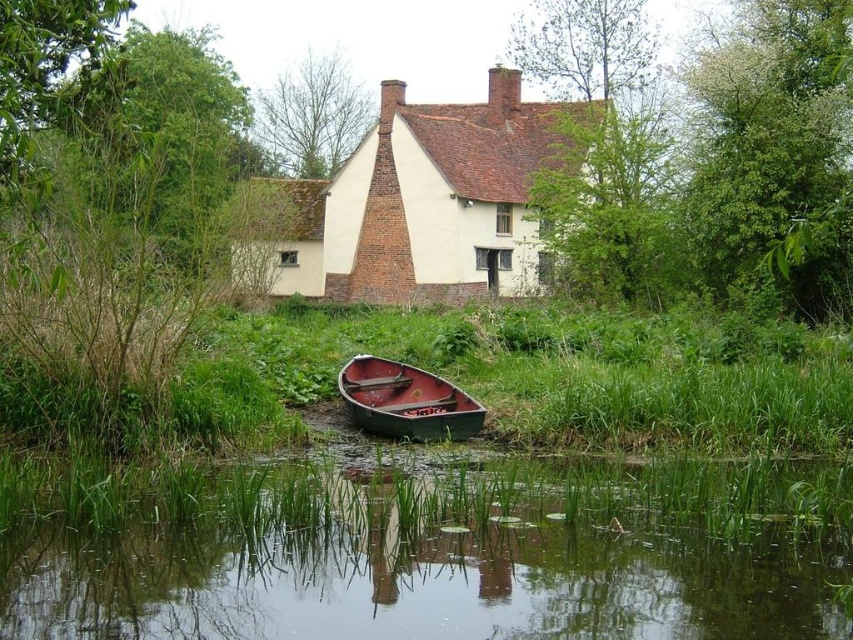
Question: Considering the relative positions of green grassy at lower center and white painted brick cottage at center in the image provided, where is green grassy at lower center located with respect to white painted brick cottage at center?

Choices:
 (A) right
 (B) left

Answer: (A)

Question: Which point appears closest to the camera in this image?

Choices:
 (A) pyautogui.click(x=816, y=360)
 (B) pyautogui.click(x=282, y=605)
 (C) pyautogui.click(x=506, y=260)

Answer: (B)

Question: In this image, where is green grassy at lower center located relative to white painted brick cottage at center?

Choices:
 (A) above
 (B) below

Answer: (B)

Question: Which object appears farthest from the camera in this image?

Choices:
 (A) white painted brick cottage at center
 (B) green grassy river at lower center
 (C) green grassy at lower center

Answer: (A)

Question: Can you confirm if green grassy at lower center is positioned to the right of white painted brick cottage at center?

Choices:
 (A) yes
 (B) no

Answer: (A)

Question: Which point is farther from the camera taking this photo?

Choices:
 (A) (370, 541)
 (B) (688, 420)
 (C) (509, 141)
 (D) (425, 394)

Answer: (C)